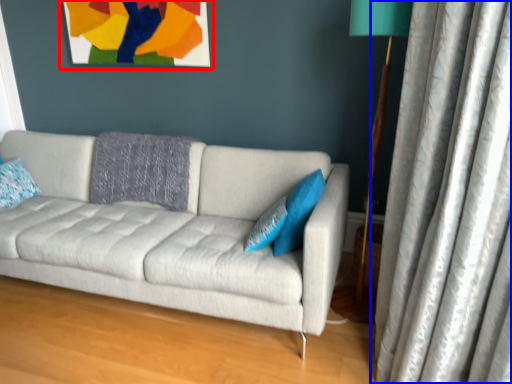
Question: Which object appears farthest to the camera in this image, picture frame (highlighted by a red box) or curtain (highlighted by a blue box)?

Choices:
 (A) picture frame
 (B) curtain

Answer: (A)